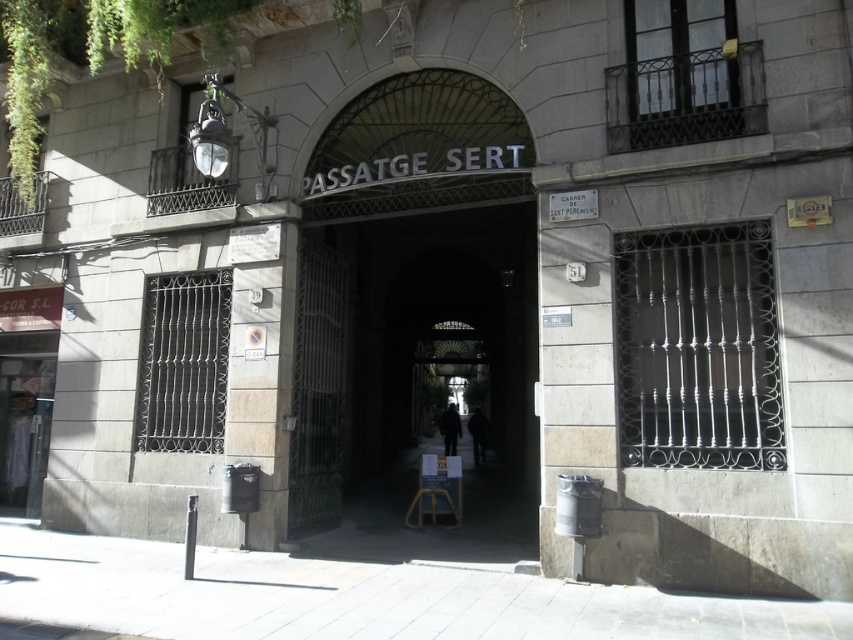
Does point (432, 400) come farther from viewer compared to point (431, 509)?

Yes, it is.

Is dark metal gate at center to the right of wooden stool at center from the viewer's perspective?

Indeed, dark metal gate at center is positioned on the right side of wooden stool at center.

I want to click on dark metal gate at center, so click(413, 360).